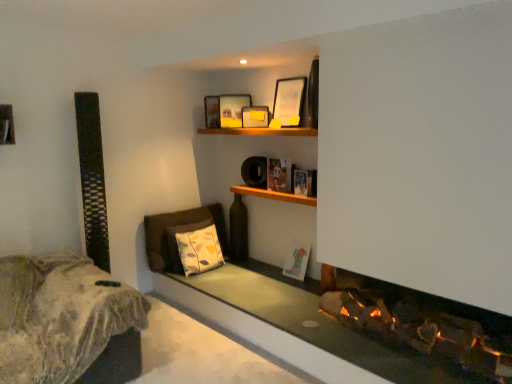
Question: In the image, is matte white picture frame at lower center, which is counted as the fourth picture frame, starting from the top, on the left side or the right side of fuzzy fabric bed at lower left?

Choices:
 (A) left
 (B) right

Answer: (B)

Question: Is matte white picture frame at lower center, which is counted as the fourth picture frame, starting from the top, inside the boundaries of fuzzy fabric bed at lower left, or outside?

Choices:
 (A) inside
 (B) outside

Answer: (B)

Question: Which is nearer to the yellow-patterned fabric pillow at lower center?

Choices:
 (A) fuzzy fabric bed at lower left
 (B) matte paper book at center
 (C) wooden shelf at center
 (D) yellow matte picture frame at upper center, which is the third picture frame from top to bottom
 (E) matte wooden picture frame at upper center, acting as the 2th picture frame starting from the top

Answer: (C)

Question: Which object is the closest to the wooden shelf at upper center?

Choices:
 (A) matte wooden picture frame at upper center, which is the first picture frame in top-to-bottom order
 (B) matte wooden picture frame at upper center, the 3th picture frame positioned from the bottom
 (C) wooden shelf at center
 (D) matte paper book at center
 (E) yellow-patterned fabric pillow at lower center

Answer: (B)